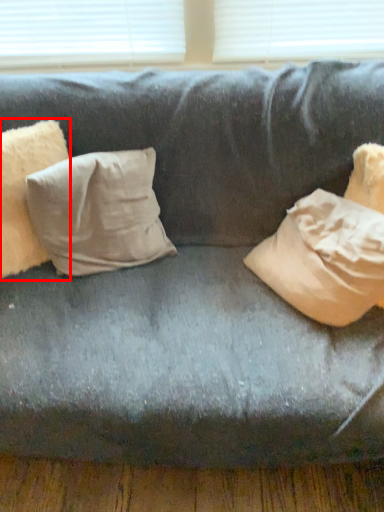
Question: From the image's perspective, where is pillow (annotated by the red box) located relative to pillow?

Choices:
 (A) below
 (B) above

Answer: (B)